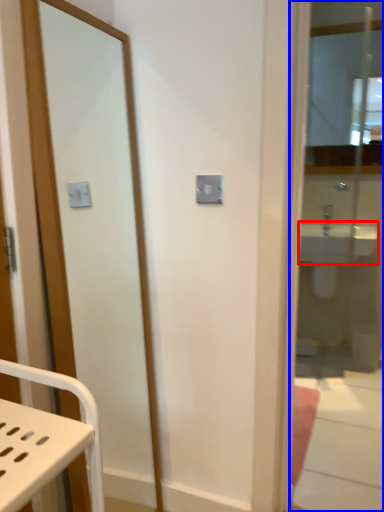
Question: Which of the following is the farthest to the observer, sink (highlighted by a red box) or mirror (highlighted by a blue box)?

Choices:
 (A) sink
 (B) mirror

Answer: (A)